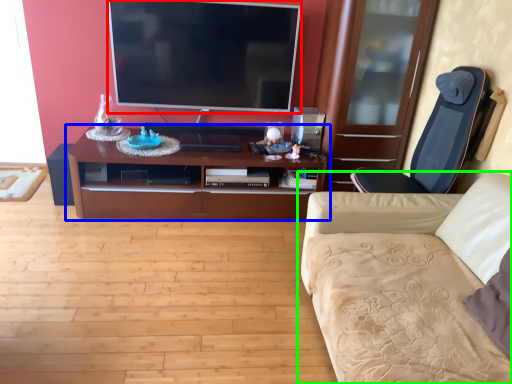
Question: Which is nearer to the television (highlighted by a red box)? cabinetry (highlighted by a blue box) or studio couch (highlighted by a green box).

Choices:
 (A) cabinetry
 (B) studio couch

Answer: (A)